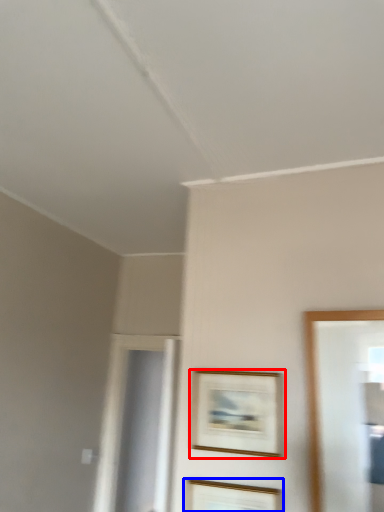
Question: Which object appears closest to the camera in this image, picture frame (highlighted by a red box) or picture frame (highlighted by a blue box)?

Choices:
 (A) picture frame
 (B) picture frame

Answer: (B)